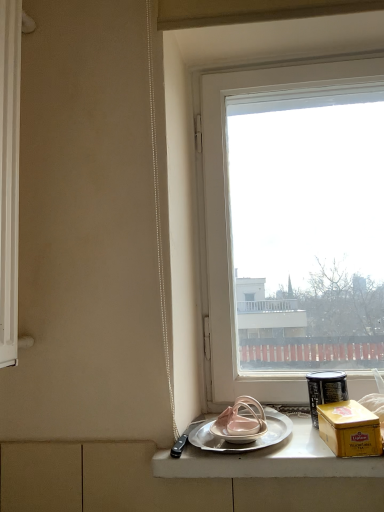
Question: Considering the relative sizes of metallic silver canister at right and transparent glass window at center in the image provided, is metallic silver canister at right smaller than transparent glass window at center?

Choices:
 (A) yes
 (B) no

Answer: (A)

Question: Does metallic silver canister at right turn towards transparent glass window at center?

Choices:
 (A) yes
 (B) no

Answer: (B)

Question: From a real-world perspective, is metallic silver canister at right below transparent glass window at center?

Choices:
 (A) yes
 (B) no

Answer: (A)

Question: Does metallic silver canister at right have a larger size compared to transparent glass window at center?

Choices:
 (A) yes
 (B) no

Answer: (B)

Question: From a real-world perspective, is metallic silver canister at right located higher than transparent glass window at center?

Choices:
 (A) yes
 (B) no

Answer: (B)

Question: In the image, is transparent glass window at center on the left side or the right side of silver metallic tray at lower center?

Choices:
 (A) left
 (B) right

Answer: (B)

Question: Considering their positions, is transparent glass window at center located in front of or behind silver metallic tray at lower center?

Choices:
 (A) behind
 (B) front

Answer: (A)

Question: Is transparent glass window at center inside or outside of silver metallic tray at lower center?

Choices:
 (A) inside
 (B) outside

Answer: (B)

Question: From the image's perspective, relative to silver metallic tray at lower center, is transparent glass window at center above or below?

Choices:
 (A) below
 (B) above

Answer: (B)

Question: From their relative heights in the image, would you say metallic silver canister at right is taller or shorter than transparent glass window at center?

Choices:
 (A) tall
 (B) short

Answer: (B)

Question: Is metallic silver canister at right wider or thinner than transparent glass window at center?

Choices:
 (A) thin
 (B) wide

Answer: (A)

Question: Based on their positions, is metallic silver canister at right located to the left or right of transparent glass window at center?

Choices:
 (A) right
 (B) left

Answer: (A)

Question: From the image's perspective, relative to transparent glass window at center, is metallic silver canister at right above or below?

Choices:
 (A) below
 (B) above

Answer: (A)

Question: Does point (329, 444) appear closer or farther from the camera than point (210, 419)?

Choices:
 (A) farther
 (B) closer

Answer: (B)

Question: Considering the positions of yellow matte box at right and silver metallic plate at lower center in the image, is yellow matte box at right taller or shorter than silver metallic plate at lower center?

Choices:
 (A) short
 (B) tall

Answer: (B)